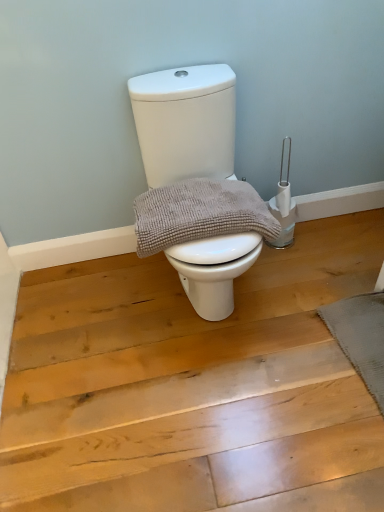
Question: From the image's perspective, is white matte toilet at center positioned above or below gray textured towel at center?

Choices:
 (A) above
 (B) below

Answer: (A)

Question: In terms of height, does white matte toilet at center look taller or shorter compared to gray textured towel at center?

Choices:
 (A) short
 (B) tall

Answer: (B)

Question: Is white matte toilet at center bigger or smaller than gray textured towel at center?

Choices:
 (A) small
 (B) big

Answer: (B)

Question: Considering the positions of gray textured towel at center and white matte toilet at center in the image, is gray textured towel at center bigger or smaller than white matte toilet at center?

Choices:
 (A) small
 (B) big

Answer: (A)

Question: Visually, is gray textured towel at center positioned to the left or to the right of white matte toilet at center?

Choices:
 (A) left
 (B) right

Answer: (A)

Question: Relative to white matte toilet at center, is gray textured towel at center in front or behind?

Choices:
 (A) front
 (B) behind

Answer: (B)

Question: Is gray textured towel at center wider or thinner than white matte toilet at center?

Choices:
 (A) thin
 (B) wide

Answer: (A)